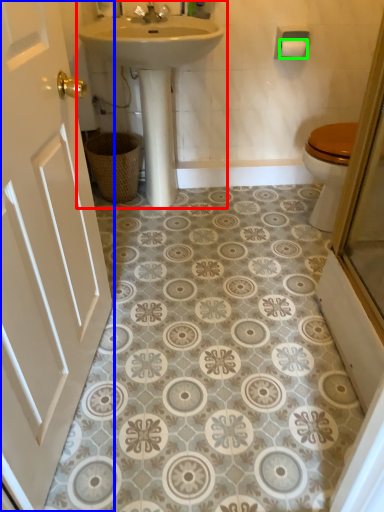
Question: Which object is positioned closest to sink (highlighted by a red box)? Select from door (highlighted by a blue box) and toilet paper (highlighted by a green box).

Choices:
 (A) door
 (B) toilet paper

Answer: (B)